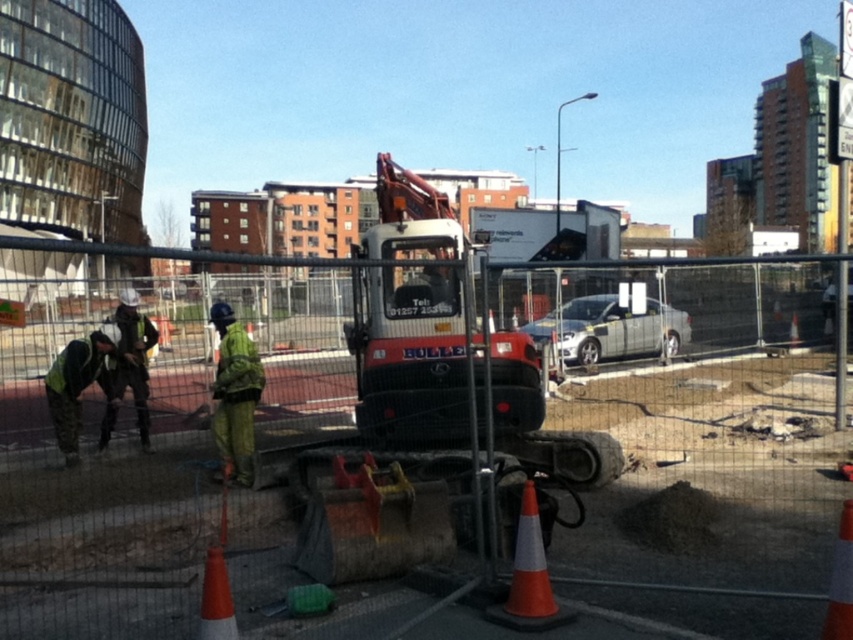
Can you confirm if matte black excavator at center is positioned above reflective yellow safety vest at lower left?

Correct, matte black excavator at center is located above reflective yellow safety vest at lower left.

Which of these two, matte black excavator at center or reflective yellow safety vest at lower left, stands taller?

matte black excavator at center

Between point (479, 449) and point (65, 397), which one is positioned in front?

Point (479, 449) is in front.

Where is `matte black excavator at center`? The image size is (853, 640). matte black excavator at center is located at coordinates (444, 444).

Between point (540, 561) and point (833, 572), which one is positioned in front?

Point (833, 572)

Is orange/white striped traffic cone at lower center to the right of orange/reflective traffic cone at center from the viewer's perspective?

No, orange/white striped traffic cone at lower center is not to the right of orange/reflective traffic cone at center.

Between point (567, 620) and point (840, 540), which one is positioned behind?

Positioned behind is point (567, 620).

Locate an element on the screen. orange/white striped traffic cone at lower center is located at coordinates (529, 577).

Which of these two, green reflective safety vest at left or orange/reflective traffic cone at center, stands shorter?

orange/reflective traffic cone at center

Can you confirm if green reflective safety vest at left is shorter than orange/reflective traffic cone at center?

Incorrect, green reflective safety vest at left's height does not fall short of orange/reflective traffic cone at center's.

Does point (154, 326) come farther from viewer compared to point (848, 589)?

Yes, it is.

Identify the location of green reflective safety vest at left. pos(129,365).